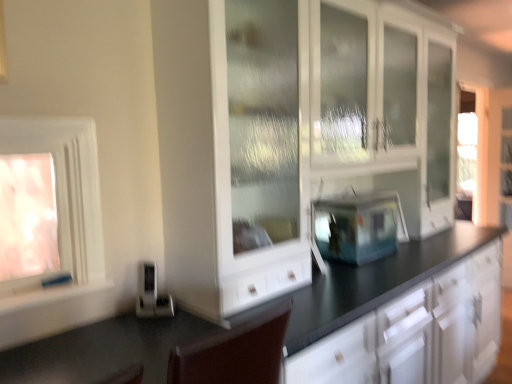
Question: Considering the relative sizes of white glossy window at left, marked as the first window in a right-to-left arrangement, and white glossy cabinet at center in the image provided, is white glossy window at left, marked as the first window in a right-to-left arrangement, taller than white glossy cabinet at center?

Choices:
 (A) yes
 (B) no

Answer: (B)

Question: From the image's perspective, would you say white glossy window at left, placed as the 2th window when sorted from left to right, is positioned over white glossy cabinet at center?

Choices:
 (A) no
 (B) yes

Answer: (B)

Question: Is white glossy window at left, marked as the first window in a right-to-left arrangement, not near white glossy cabinet at center?

Choices:
 (A) yes
 (B) no

Answer: (B)

Question: Is white glossy window at left, marked as the first window in a right-to-left arrangement, bigger than white glossy cabinet at center?

Choices:
 (A) yes
 (B) no

Answer: (B)

Question: From a real-world perspective, does white glossy window at left, placed as the 2th window when sorted from left to right, sit lower than white glossy cabinet at center?

Choices:
 (A) yes
 (B) no

Answer: (B)

Question: From their relative heights in the image, would you say white matte window sill at lower left is taller or shorter than translucent glass window at left, which ranks as the second window in right-to-left order?

Choices:
 (A) tall
 (B) short

Answer: (B)

Question: From a real-world perspective, is white matte window sill at lower left physically located above or below translucent glass window at left, which ranks as the second window in right-to-left order?

Choices:
 (A) below
 (B) above

Answer: (A)

Question: Is white matte window sill at lower left wider or thinner than translucent glass window at left, which ranks as the second window in right-to-left order?

Choices:
 (A) wide
 (B) thin

Answer: (A)

Question: Is white matte window sill at lower left spatially inside translucent glass window at left, positioned as the first window in left-to-right order, or outside of it?

Choices:
 (A) inside
 (B) outside

Answer: (B)

Question: From the image's perspective, is white matte window sill at lower left above or below satin silver toaster at lower left, the first appliance when ordered from front to back?

Choices:
 (A) above
 (B) below

Answer: (A)

Question: Considering their positions, is white matte window sill at lower left located in front of or behind satin silver toaster at lower left, the first appliance when ordered from front to back?

Choices:
 (A) behind
 (B) front

Answer: (B)

Question: Looking at the image, does white matte window sill at lower left seem bigger or smaller compared to satin silver toaster at lower left, the 1th appliance from the left?

Choices:
 (A) big
 (B) small

Answer: (A)

Question: Choose the correct answer: Is white matte window sill at lower left inside satin silver toaster at lower left, which appears as the 2th appliance when viewed from the back, or outside it?

Choices:
 (A) inside
 (B) outside

Answer: (B)

Question: From the image's perspective, is satin silver toaster at lower left, the 1th appliance from the left, positioned above or below white glossy window at left, placed as the 2th window when sorted from left to right?

Choices:
 (A) below
 (B) above

Answer: (A)

Question: From a real-world perspective, is satin silver toaster at lower left, the 1th appliance from the left, above or below white glossy window at left, marked as the first window in a right-to-left arrangement?

Choices:
 (A) below
 (B) above

Answer: (A)